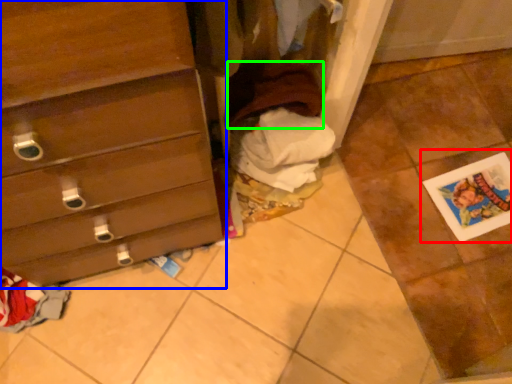
Question: Estimate the real-world distances between objects in this image. Which object is farther from postcard (highlighted by a red box), chest of drawers (highlighted by a blue box) or clothing (highlighted by a green box)?

Choices:
 (A) chest of drawers
 (B) clothing

Answer: (A)